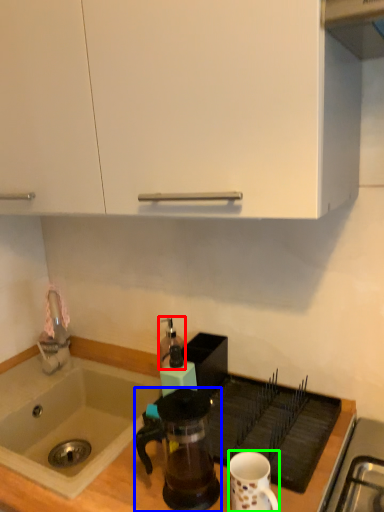
Question: Which is nearer to the kitchen appliance (highlighted by a red box)? coffee maker (highlighted by a blue box) or coffee cup (highlighted by a green box).

Choices:
 (A) coffee maker
 (B) coffee cup

Answer: (A)